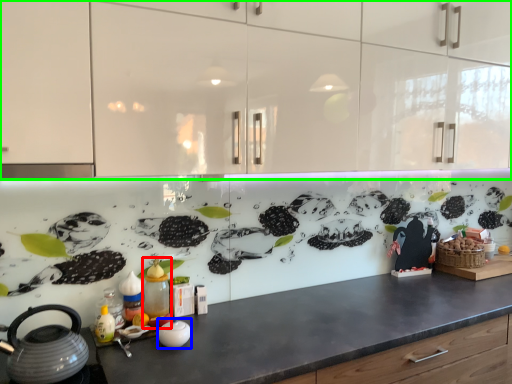
Question: Based on their relative distances, which object is nearer to bottle (highlighted by a red box)? Choose from appliance (highlighted by a blue box) and cabinetry (highlighted by a green box).

Choices:
 (A) appliance
 (B) cabinetry

Answer: (A)